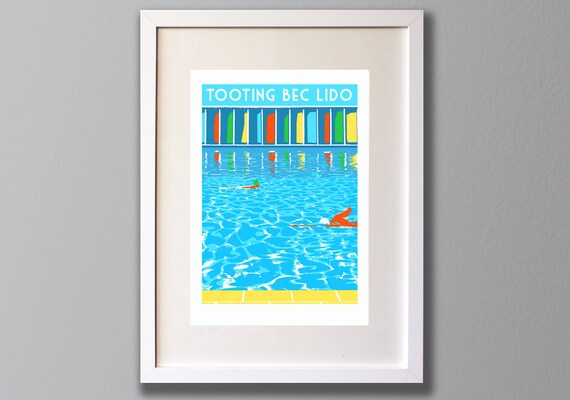
Find the location of a particular element. The width and height of the screenshot is (570, 400). picture frame is located at coordinates (146, 210), (414, 180), (299, 14), (260, 379).